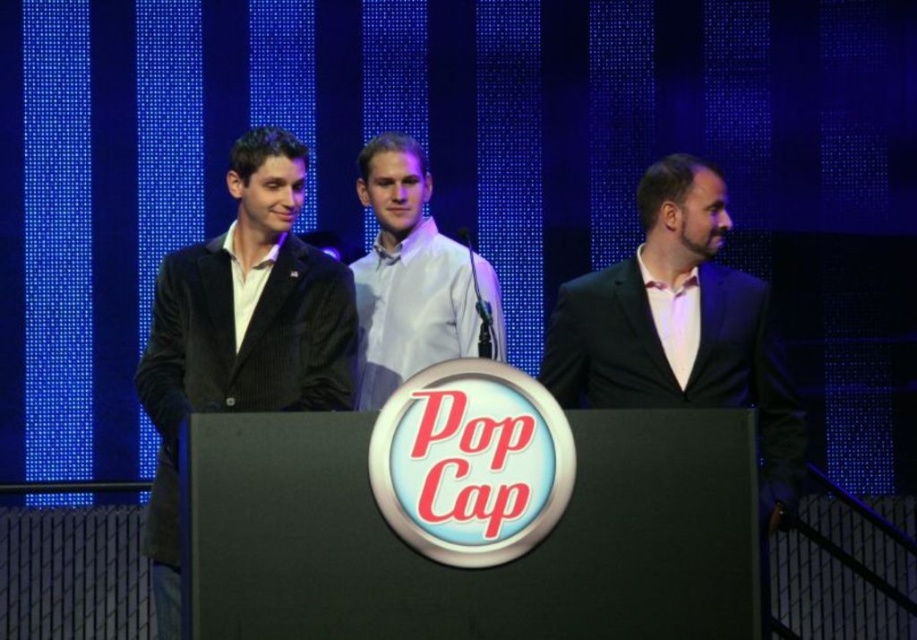
What are the coordinates of `velvet black suit at left` in the screenshot? It's located at (241, 332).

Who is more forward, (326,346) or (600,308)?

Point (326,346)

Is point (297, 362) farther from camera compared to point (791, 422)?

That is False.

Locate an element on the screen. The image size is (917, 640). velvet black suit at left is located at coordinates (241, 332).

Based on the photo, which of these two, velvet black suit at left or white glossy shirt at center, stands taller?

Standing taller between the two is velvet black suit at left.

Can you confirm if velvet black suit at left is positioned above white glossy shirt at center?

No, velvet black suit at left is not above white glossy shirt at center.

Which is behind, point (341, 339) or point (390, 262)?

The point (390, 262) is more distant.

Where is `velvet black suit at left`? The image size is (917, 640). velvet black suit at left is located at coordinates (241, 332).

Between matte black suit at right and white glossy shirt at center, which one is positioned lower?

matte black suit at right is lower down.

Based on the photo, who is more distant from viewer, (759, 310) or (374, 344)?

The point (374, 344) is behind.

Image resolution: width=917 pixels, height=640 pixels. What are the coordinates of `matte black suit at right` in the screenshot? It's located at (678, 326).